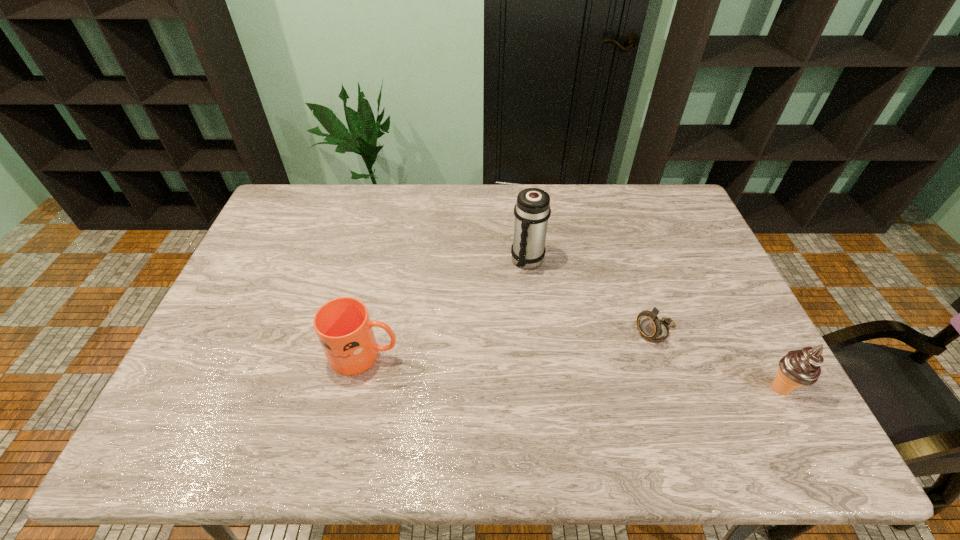
Where is `mug`? This screenshot has width=960, height=540. mug is located at coordinates (343, 326).

Identify the location of the rightmost object. (801, 367).

Identify the location of the third object from left to right. (653, 329).

Locate an element on the screen. Image resolution: width=960 pixels, height=540 pixels. compass is located at coordinates (653, 329).

I want to click on the second object from left to right, so click(532, 210).

Where is `the farthest object`? the farthest object is located at coordinates coord(532,210).

The height and width of the screenshot is (540, 960). I want to click on free space located 0.210m on the handle side of the leftmost object, so click(x=481, y=355).

Identify the location of vacant space located 0.250m on the back of the icecream. pyautogui.click(x=733, y=299).

The width and height of the screenshot is (960, 540). I want to click on vacant space situated 0.290m on the face of the second object from right to left, so click(549, 387).

This screenshot has width=960, height=540. What are the coordinates of `blank space located 0.080m on the face of the second object from right to left` in the screenshot? It's located at (615, 352).